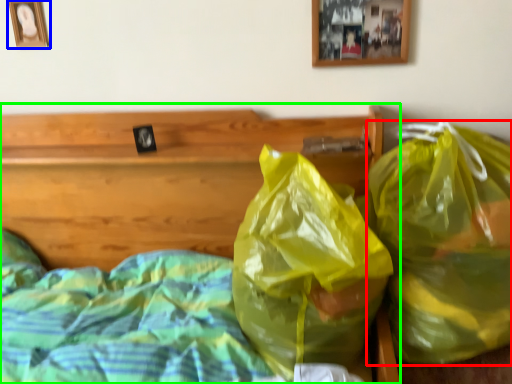
Question: Estimate the real-world distances between objects in this image. Which object is closer to plastic bag (highlighted by a red box), picture frame (highlighted by a blue box) or bed (highlighted by a green box)?

Choices:
 (A) picture frame
 (B) bed

Answer: (B)